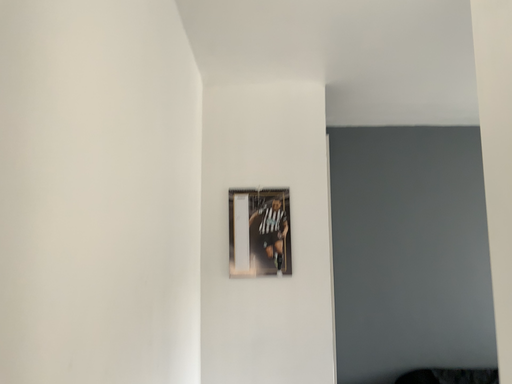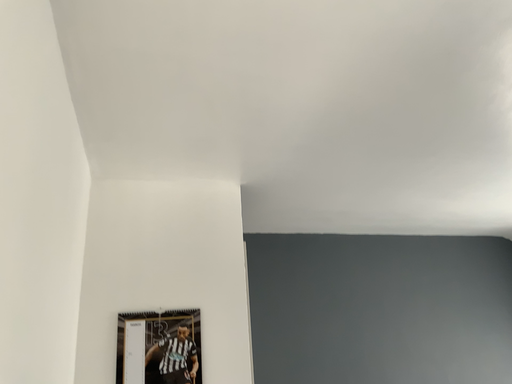
Question: How did the camera likely rotate when shooting the video?

Choices:
 (A) rotated downward
 (B) rotated upward

Answer: (B)